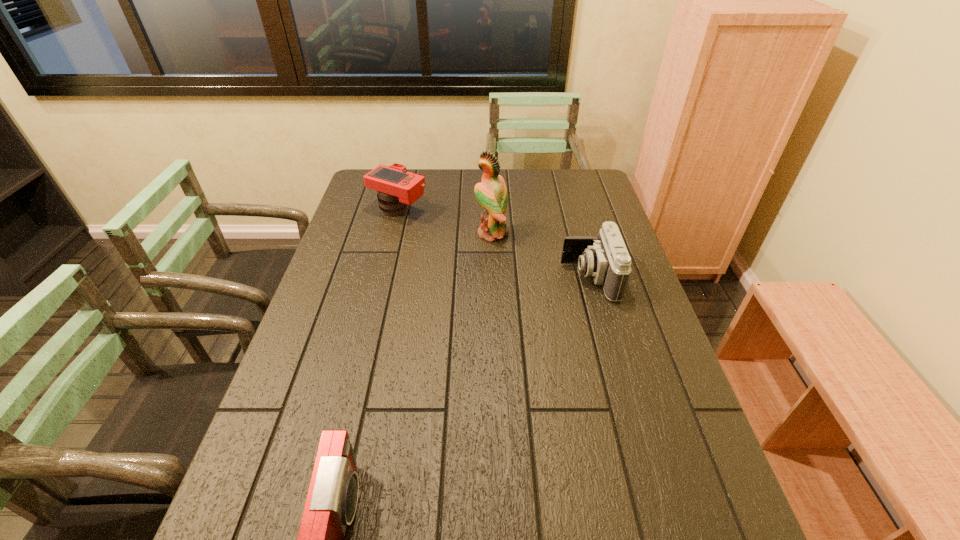
The width and height of the screenshot is (960, 540). Find the location of `vacant space located 0.130m at the front of the second nearest camera with an open lens cover`. vacant space located 0.130m at the front of the second nearest camera with an open lens cover is located at coordinates (518, 278).

You are a GUI agent. You are given a task and a screenshot of the screen. Output one action in this format:
    pyautogui.click(x=<x>, y=<y>)
    Task: Click on the vacant space situated 0.180m at the front of the second nearest camera with an open lens cover
    
    Given the screenshot: What is the action you would take?
    pyautogui.click(x=501, y=278)

This screenshot has height=540, width=960. In order to click on object located in the far edge section of the desktop in this screenshot , I will do `click(397, 188)`.

The image size is (960, 540). In order to click on object that is positioned at the left edge in this screenshot , I will do `click(397, 188)`.

Find the location of `object at the right edge`. object at the right edge is located at coordinates (605, 258).

This screenshot has width=960, height=540. I want to click on object at the far left corner, so (x=397, y=188).

In the image, there is a desktop. Where is `free space at the far edge`? This screenshot has width=960, height=540. free space at the far edge is located at coordinates (436, 177).

Where is `vacant space at the left edge of the desktop`? This screenshot has width=960, height=540. vacant space at the left edge of the desktop is located at coordinates (267, 436).

You are a GUI agent. You are given a task and a screenshot of the screen. Output one action in this format:
    pyautogui.click(x=<x>, y=<y>)
    Task: Click on the vacant region at the right edge of the desktop
    
    Given the screenshot: What is the action you would take?
    pyautogui.click(x=641, y=494)

You are a GUI agent. You are given a task and a screenshot of the screen. Output one action in this format:
    pyautogui.click(x=<x>, y=<y>)
    Task: Click on the vacant space that is in between the farthest camera and the second nearest camera
    This screenshot has width=960, height=540.
    Given the screenshot: What is the action you would take?
    pyautogui.click(x=494, y=244)